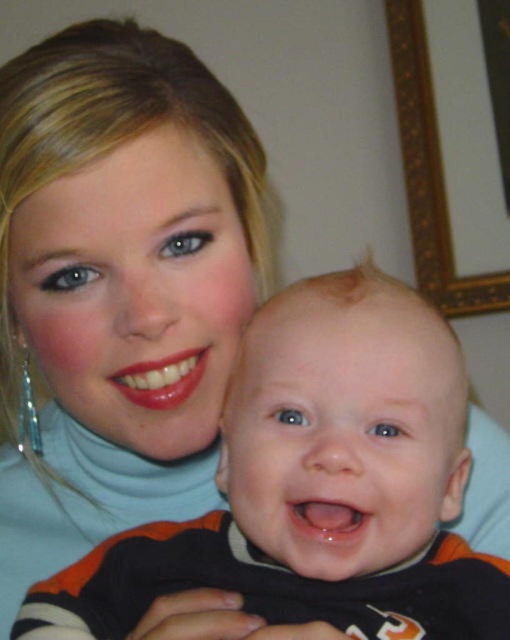
Can you confirm if black cotton onesie at center is wider than gold ornate frame at upper right?

Yes, black cotton onesie at center is wider than gold ornate frame at upper right.

Which is more to the left, black cotton onesie at center or gold ornate frame at upper right?

Positioned to the left is black cotton onesie at center.

What do you see at coordinates (317, 484) in the screenshot? This screenshot has height=640, width=510. I see `black cotton onesie at center` at bounding box center [317, 484].

At what (x,y) coordinates should I click in order to perform the action: click on black cotton onesie at center. Please return your answer as a coordinate pair (x, y). This screenshot has height=640, width=510. Looking at the image, I should click on (x=317, y=484).